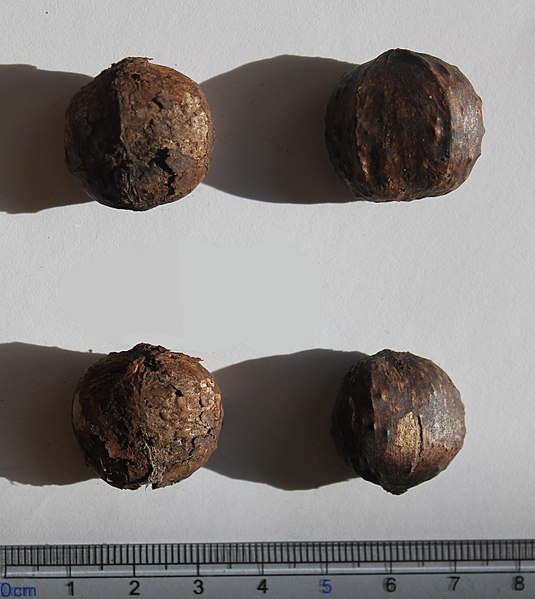
Locate an element on the screen. plastic ruler is located at coordinates (430, 588).